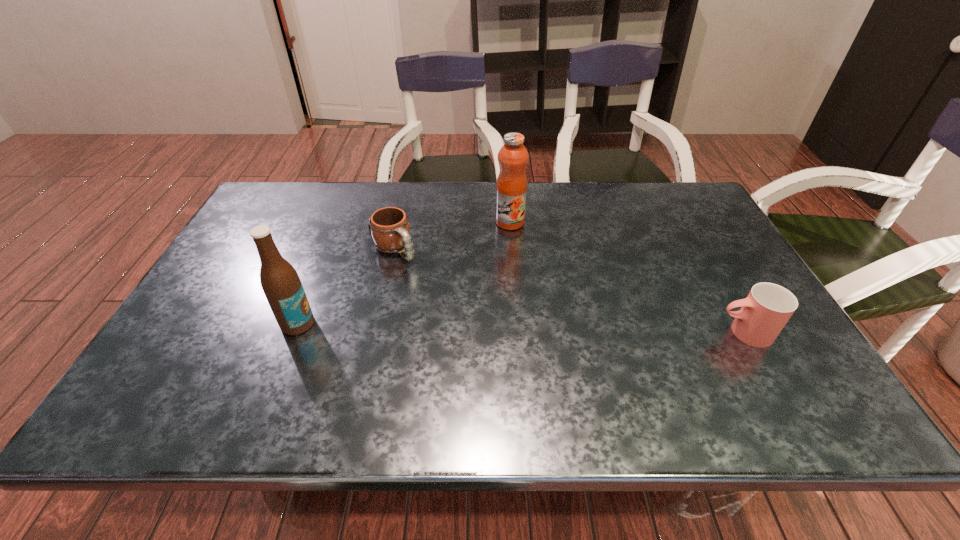
This screenshot has width=960, height=540. What are the coordinates of `free space that satisfies the following two spatial constraints: 1. on the back side of the fruit juice; 2. on the left side of the leftmost object` in the screenshot? It's located at (338, 222).